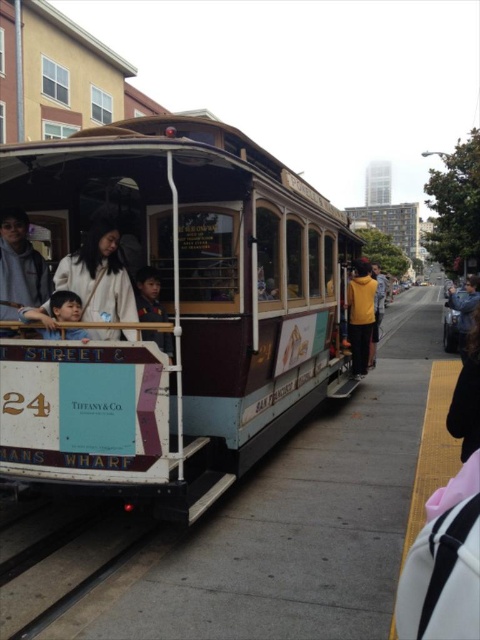
Question: Can you confirm if wooden polished cable car at center is thinner than black metal train track at lower left?

Choices:
 (A) no
 (B) yes

Answer: (A)

Question: Can you confirm if wooden polished cable car at center is positioned to the left of black metal train track at lower left?

Choices:
 (A) no
 (B) yes

Answer: (A)

Question: Among these objects, which one is nearest to the camera?

Choices:
 (A) black metal train track at lower left
 (B) wooden polished cable car at center
 (C) yellow matte jacket at center

Answer: (A)

Question: Does black metal train track at lower left appear on the left side of matte black shirt at center?

Choices:
 (A) yes
 (B) no

Answer: (A)

Question: Among these objects, which one is nearest to the camera?

Choices:
 (A) black metal train track at lower left
 (B) matte black shirt at center
 (C) yellow matte jacket at center
 (D) wooden polished cable car at center

Answer: (A)

Question: Which point is closer to the camera?

Choices:
 (A) wooden polished cable car at center
 (B) black metal train track at lower left
 (C) matte black shirt at center
 (D) yellow matte jacket at center

Answer: (B)